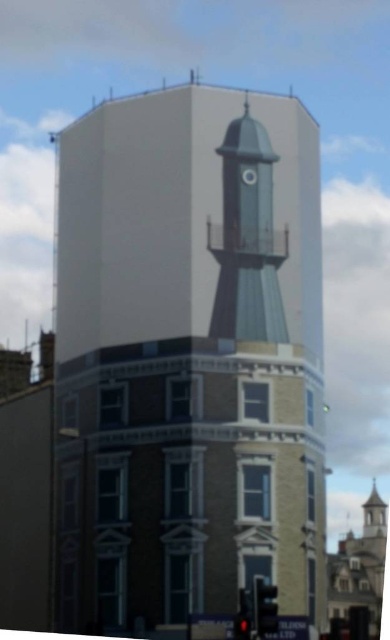
Who is positioned more to the right, metallic reflective sign at center or red glass traffic light at lower center?

From the viewer's perspective, metallic reflective sign at center appears more on the right side.

Is metallic reflective sign at center to the right of red glass traffic light at lower center from the viewer's perspective?

Correct, you'll find metallic reflective sign at center to the right of red glass traffic light at lower center.

I want to click on metallic reflective sign at center, so click(x=290, y=628).

The image size is (390, 640). In order to click on metallic reflective sign at center in this screenshot , I will do `click(290, 628)`.

Which is behind, point (278, 184) or point (269, 627)?

The point (278, 184) is behind.

Does smooth gray tower at center appear over matte black traffic light at lower center?

Yes, smooth gray tower at center is above matte black traffic light at lower center.

Is point (134, 444) farther from camera compared to point (260, 592)?

Yes, it is.

You are a GUI agent. You are given a task and a screenshot of the screen. Output one action in this format:
    pyautogui.click(x=<x>, y=<y>)
    Task: Click on the smooth gray tower at center
    This screenshot has width=390, height=640.
    Given the screenshot: What is the action you would take?
    pyautogui.click(x=187, y=358)

Is metallic gray water tower at center above metallic reflective sign at center?

Yes.

Looking at this image, which of these two, metallic gray water tower at center or metallic reflective sign at center, stands taller?

With more height is metallic gray water tower at center.

Between point (221, 308) and point (283, 636), which one is positioned in front?

Point (283, 636)

Locate an element on the screen. The image size is (390, 640). metallic gray water tower at center is located at coordinates (248, 241).